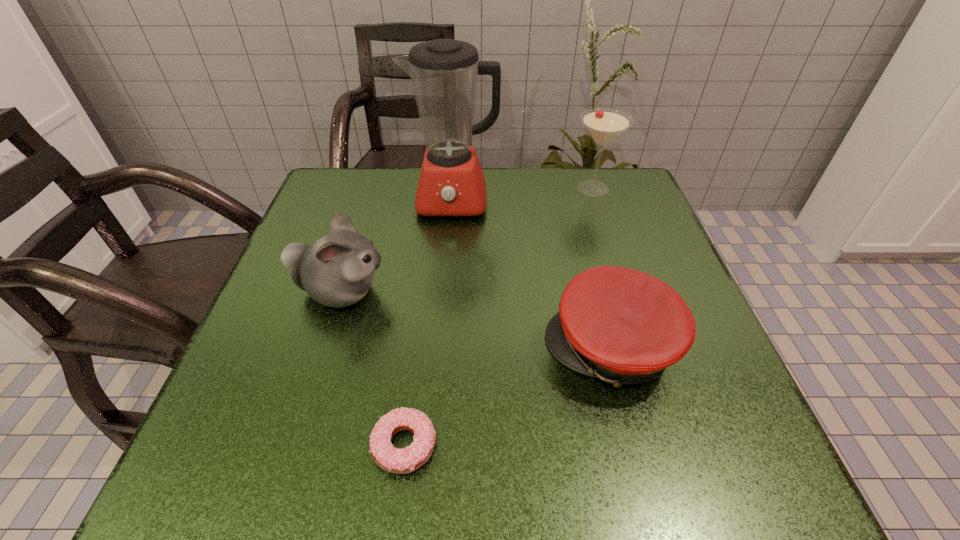
You are a GUI agent. You are given a task and a screenshot of the screen. Output one action in this format:
    pyautogui.click(x=<x>, y=<y>)
    Task: Click on the vacant space located 0.230m on the front of the cap with an emblem
    The height and width of the screenshot is (540, 960).
    Given the screenshot: What is the action you would take?
    pyautogui.click(x=413, y=348)

The image size is (960, 540). I want to click on free space located 0.210m on the front of the cap with an emblem, so click(x=424, y=348).

What are the coordinates of `free space located 0.280m on the front of the cap with an emblem` in the screenshot? It's located at (384, 348).

In order to click on vacant space located on the right of the nearest object in this screenshot , I will do `click(700, 445)`.

You are a GUI agent. You are given a task and a screenshot of the screen. Output one action in this format:
    pyautogui.click(x=<x>, y=<y>)
    Task: Click on the blender located in the far edge section of the desktop
    
    Given the screenshot: What is the action you would take?
    pyautogui.click(x=444, y=73)

Where is `martini that is positioned at the far edge`? The image size is (960, 540). martini that is positioned at the far edge is located at coordinates (604, 125).

Where is `object located at the near edge`? object located at the near edge is located at coordinates (394, 460).

Locate an element on the screen. object located at the left edge is located at coordinates (337, 270).

The width and height of the screenshot is (960, 540). I want to click on martini present at the right edge, so click(x=604, y=125).

Where is `cap that is at the right edge`? This screenshot has height=540, width=960. cap that is at the right edge is located at coordinates (623, 326).